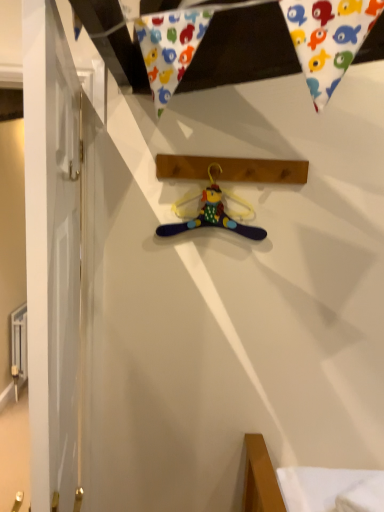
Identify the location of free spot above brown wooden plank at center (from a real-world perspective). (225, 150).